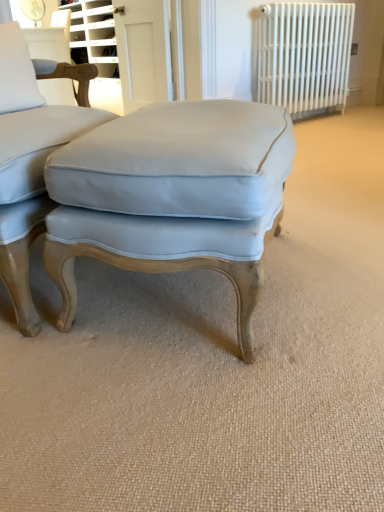
Question: Is point (269, 37) positioned closer to the camera than point (18, 174)?

Choices:
 (A) farther
 (B) closer

Answer: (A)

Question: From a real-world perspective, relative to light blue fabric ottoman at center, is white metal radiator at upper right vertically above or below?

Choices:
 (A) below
 (B) above

Answer: (B)

Question: Which of these objects is positioned closest to the light blue fabric stool at center?

Choices:
 (A) light blue fabric ottoman at center
 (B) white glossy door at upper center
 (C) white metal radiator at upper right

Answer: (A)

Question: Which is farther from the white glossy door at upper center?

Choices:
 (A) white metal radiator at upper right
 (B) light blue fabric ottoman at center
 (C) light blue fabric stool at center

Answer: (C)